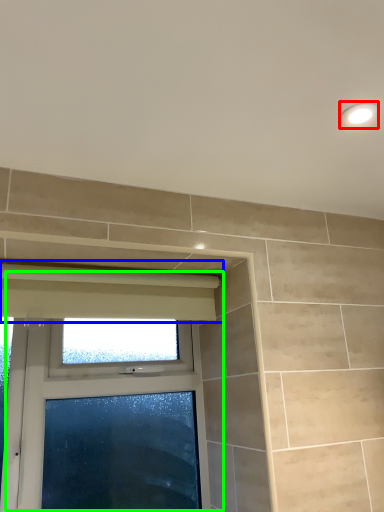
Question: Based on their relative distances, which object is nearer to light fixture (highlighted by a red box)? Choose from curtain (highlighted by a blue box) and window (highlighted by a green box).

Choices:
 (A) curtain
 (B) window

Answer: (A)